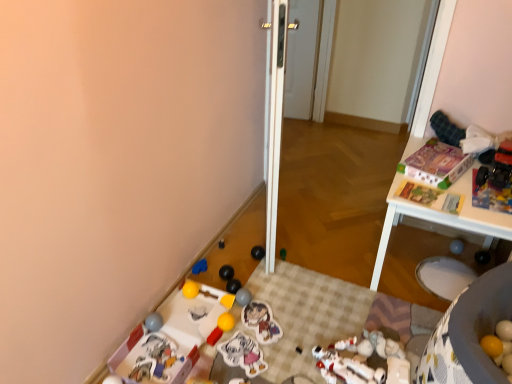
The height and width of the screenshot is (384, 512). Identify the location of unoccupied space behind plastic toy car at lower left, the 2th toy positioned from the left. (177, 320).